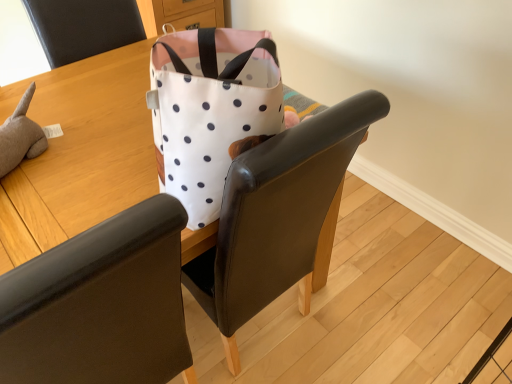
You are a GUI agent. You are given a task and a screenshot of the screen. Output one action in this format:
    pyautogui.click(x=<x>, y=<y>)
    Task: Click on the free space above white fabric bag at upper center (from a real-world perspective)
    The image size is (512, 384).
    Given the screenshot: What is the action you would take?
    pyautogui.click(x=84, y=150)